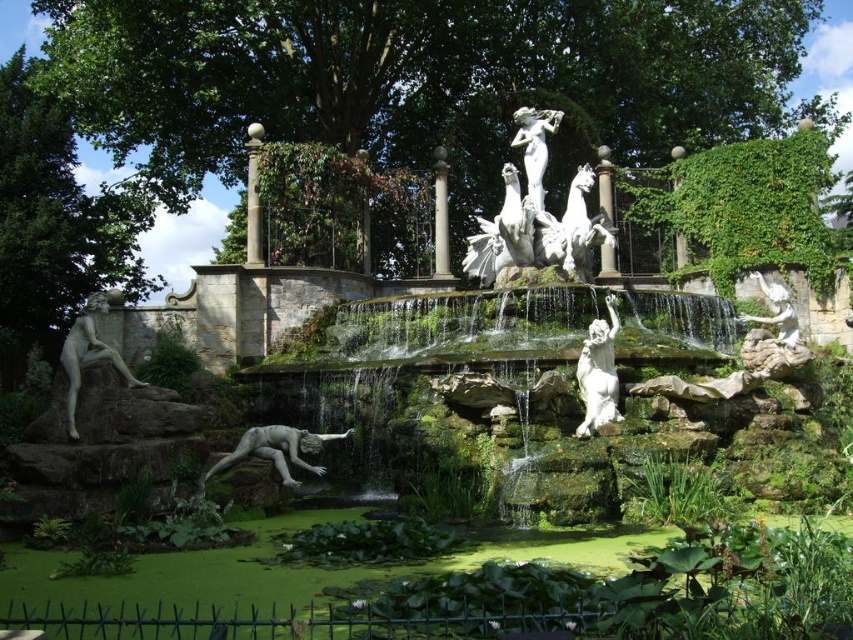
Question: Considering the relative positions of white stone fountain at center and white marble sculpture at center in the image provided, where is white stone fountain at center located with respect to white marble sculpture at center?

Choices:
 (A) above
 (B) below

Answer: (B)

Question: Which of the following is the closest to the observer?

Choices:
 (A) (544, 244)
 (B) (699, 224)

Answer: (A)

Question: Which object is closer to the camera taking this photo?

Choices:
 (A) white marble statue at center
 (B) white stone fountain at center
 (C) white marble statue at left

Answer: (B)

Question: In this image, where is white marble sculpture at center located relative to smooth stone column at upper left?

Choices:
 (A) above
 (B) below

Answer: (B)

Question: Does green mossy wall at upper right have a lesser width compared to white marble statue at left?

Choices:
 (A) no
 (B) yes

Answer: (A)

Question: Which point is closer to the camera?

Choices:
 (A) (445, 243)
 (B) (527, 150)
 (C) (258, 204)

Answer: (C)